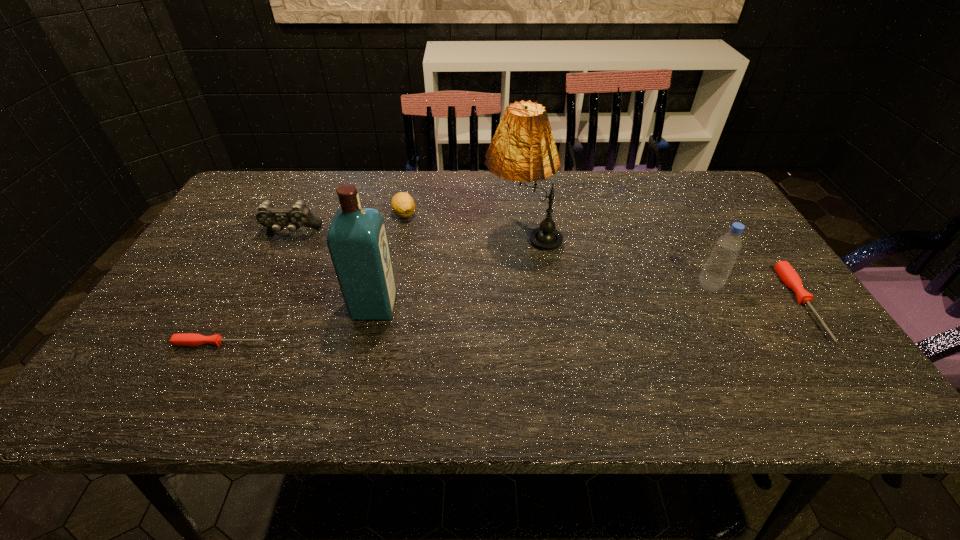
Choose which object is the nearest neighbor to the lemon. Please provide its 2D coordinates. Your answer should be formatted as a tuple, i.e. [(x, y)], where the tuple contains the x and y coordinates of a point satisfying the conditions above.

[(299, 215)]

At what (x,y) coordinates should I click in order to perform the action: click on object that ranks as the sixth closest to the sixth object from left to right. Please return your answer as a coordinate pair (x, y). Looking at the image, I should click on (184, 339).

In order to click on blank area in the image that satisfies the following two spatial constraints: 1. on the surface of the control with buttons; 2. at the tip of the shortest object in this screenshot , I will do `click(237, 343)`.

Identify the location of blank space that satisfies the following two spatial constraints: 1. on the surface of the fourth shortest object with buttons; 2. at the tip of the shortest object. This screenshot has width=960, height=540. (237, 343).

The height and width of the screenshot is (540, 960). I want to click on free spot that satisfies the following two spatial constraints: 1. on the surface of the control with buttons; 2. at the tip of the left screwdriver, so click(x=237, y=343).

The height and width of the screenshot is (540, 960). I want to click on free region that satisfies the following two spatial constraints: 1. at the tip of the second shortest object; 2. on the flat label side of the liquor, so click(x=804, y=306).

Locate an element on the screen. Image resolution: width=960 pixels, height=540 pixels. free spot that satisfies the following two spatial constraints: 1. at the tip of the second shortest object; 2. at the tip of the left screwdriver is located at coordinates (831, 343).

Locate an element on the screen. Image resolution: width=960 pixels, height=540 pixels. free space that satisfies the following two spatial constraints: 1. at the tip of the sixth tallest object; 2. on the flat label side of the liquor is located at coordinates (804, 306).

You are a GUI agent. You are given a task and a screenshot of the screen. Output one action in this format:
    pyautogui.click(x=<x>, y=<y>)
    Task: Click on the vacant space that satisfies the following two spatial constraints: 1. on the front side of the bottle; 2. at the tip of the shorter screwdriver
    
    Given the screenshot: What is the action you would take?
    point(740,343)